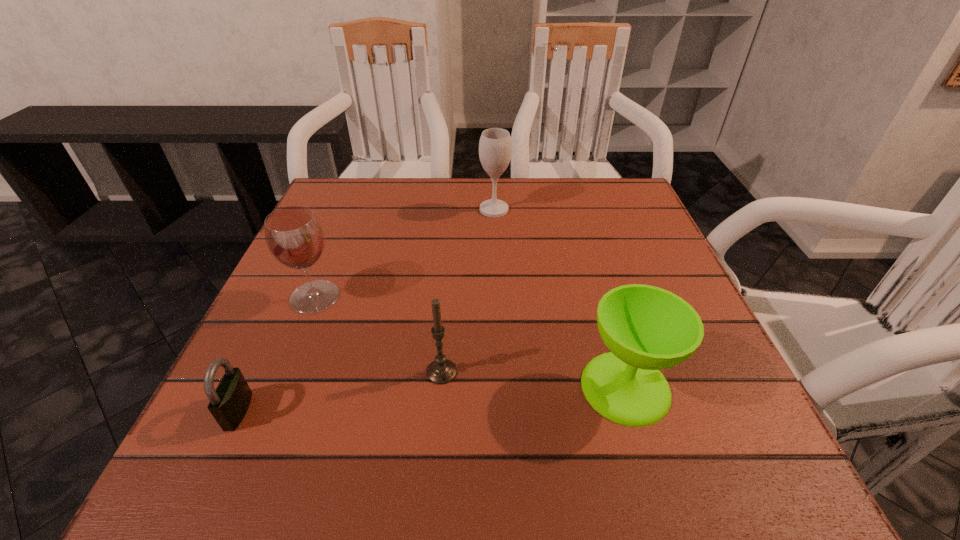
Image resolution: width=960 pixels, height=540 pixels. I want to click on the farthest object, so click(495, 146).

The height and width of the screenshot is (540, 960). In order to click on the second wineglass from right to left in this screenshot , I will do `click(495, 146)`.

The height and width of the screenshot is (540, 960). Identify the location of the fourth nearest object. (294, 236).

Where is `the leftmost wineglass`? This screenshot has width=960, height=540. the leftmost wineglass is located at coordinates (294, 236).

I want to click on candle, so click(x=441, y=371).

The image size is (960, 540). I want to click on the rightmost object, so click(646, 328).

Where is `the nearest wineglass`? Image resolution: width=960 pixels, height=540 pixels. the nearest wineglass is located at coordinates (646, 328).

At what (x,y) coordinates should I click in order to perform the action: click on padlock. Please return your answer as a coordinate pair (x, y). This screenshot has height=540, width=960. Looking at the image, I should click on (229, 403).

The height and width of the screenshot is (540, 960). I want to click on free location located on the right of the second object from right to left, so click(x=605, y=210).

What are the coordinates of `vacant region located 0.350m on the back of the leftmost wineglass` in the screenshot? It's located at (357, 193).